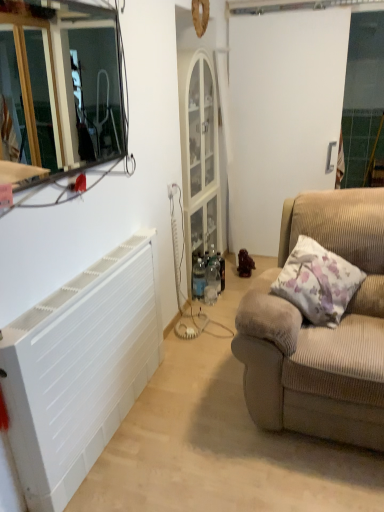
Question: From a real-world perspective, relative to beige corduroy couch at right, is fluffy beige pillow at right vertically above or below?

Choices:
 (A) below
 (B) above

Answer: (B)

Question: From the image's perspective, is fluffy beige pillow at right above or below beige corduroy couch at right?

Choices:
 (A) below
 (B) above

Answer: (B)

Question: Which of these objects is positioned farthest from the metallic glass window frame at upper left?

Choices:
 (A) brown matte figurine at center-right
 (B) white matte door at center
 (C) beige corduroy couch at right
 (D) white plastic radiator at left
 (E) fluffy beige pillow at right

Answer: (E)

Question: Estimate the real-world distances between objects in this image. Which object is closer to the metallic glass window frame at upper left?

Choices:
 (A) beige corduroy couch at right
 (B) brown matte figurine at center-right
 (C) white plastic radiator at left
 (D) white matte door at center
 (E) fluffy beige pillow at right

Answer: (D)